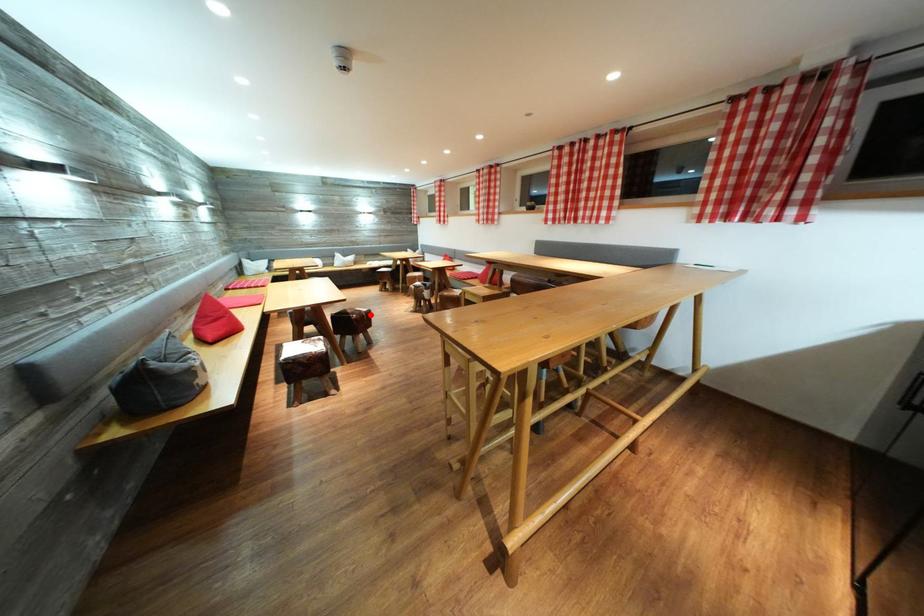
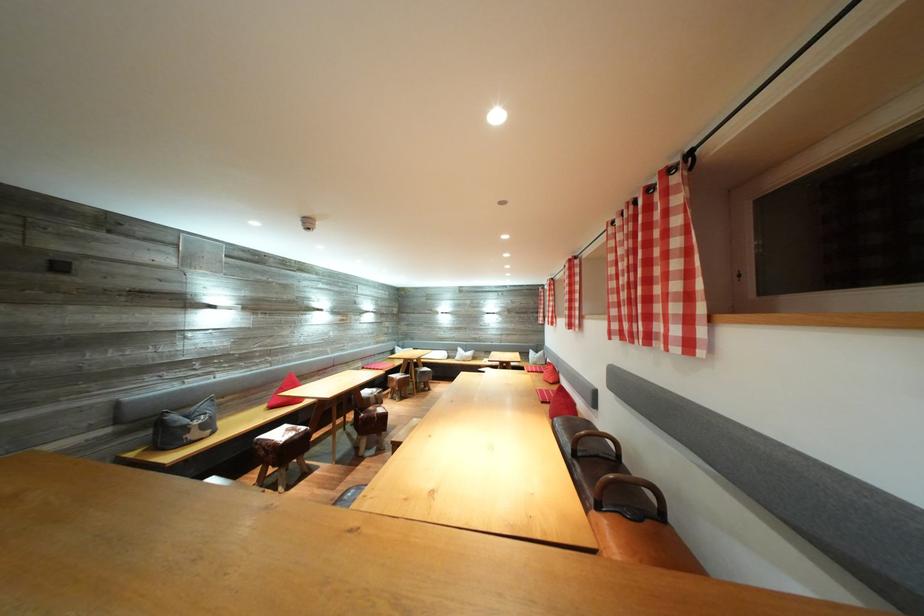
Question: I am providing you with two images of the same scene from different viewpoints. A red point is shown in image1. For the corresponding object point in image2, is it positioned nearer or farther from the camera?

Choices:
 (A) Nearer
 (B) Farther

Answer: (A)